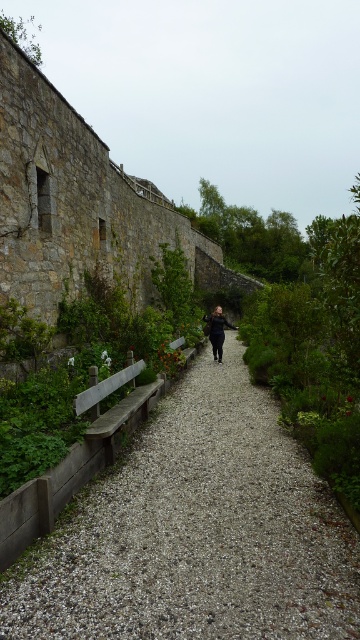
Who is positioned more to the right, wooden bench at left or black matte jacket at center?

From the viewer's perspective, black matte jacket at center appears more on the right side.

Does wooden bench at left come behind black matte jacket at center?

No, wooden bench at left is closer to the viewer.

Is point (144, 406) farther from camera compared to point (217, 340)?

No, it is in front of (217, 340).

Locate an element on the screen. This screenshot has width=360, height=640. wooden bench at left is located at coordinates (114, 404).

Who is higher up, gray gravel at center or wooden bench at left?

wooden bench at left is higher up.

Who is more forward, (119, 532) or (162, 381)?

Point (119, 532) is more forward.

Which is behind, point (32, 563) or point (93, 420)?

The point (93, 420) is behind.

At what (x,y) coordinates should I click in order to perform the action: click on gray gravel at center. Please return your answer as a coordinate pair (x, y). The image size is (360, 640). Looking at the image, I should click on (195, 532).

Between gray gravel at center and black matte jacket at center, which one is positioned higher?

Positioned higher is black matte jacket at center.

Is the position of gray gravel at center more distant than that of black matte jacket at center?

No.

Between point (115, 616) and point (223, 337), which one is positioned behind?

Point (223, 337)

The width and height of the screenshot is (360, 640). I want to click on gray gravel at center, so click(x=195, y=532).